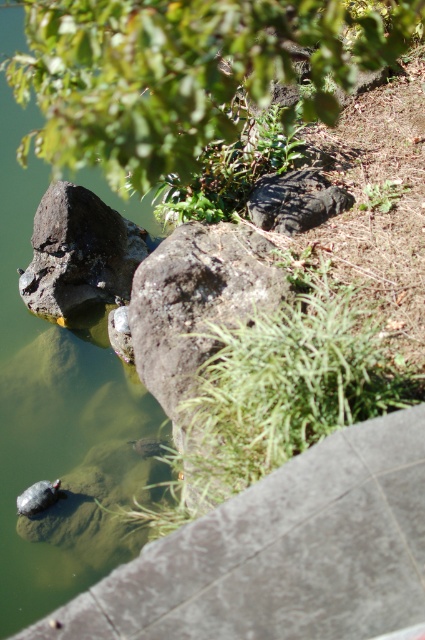
Question: Is green stone water at left to the right of rough textured rock at left from the viewer's perspective?

Choices:
 (A) yes
 (B) no

Answer: (B)

Question: Which of these objects is positioned closest to the green stone water at left?

Choices:
 (A) rough textured rock at left
 (B) green leafy tree at upper center

Answer: (A)

Question: Can you confirm if green leafy tree at upper center is bigger than green stone water at left?

Choices:
 (A) no
 (B) yes

Answer: (A)

Question: Which object is the closest to the rough textured rock at left?

Choices:
 (A) green stone water at left
 (B) green leafy tree at upper center

Answer: (A)

Question: Can you confirm if green leafy tree at upper center is positioned below rough textured rock at left?

Choices:
 (A) no
 (B) yes

Answer: (A)

Question: Among these objects, which one is farthest from the camera?

Choices:
 (A) green leafy tree at upper center
 (B) rough textured rock at left
 (C) green stone water at left

Answer: (B)